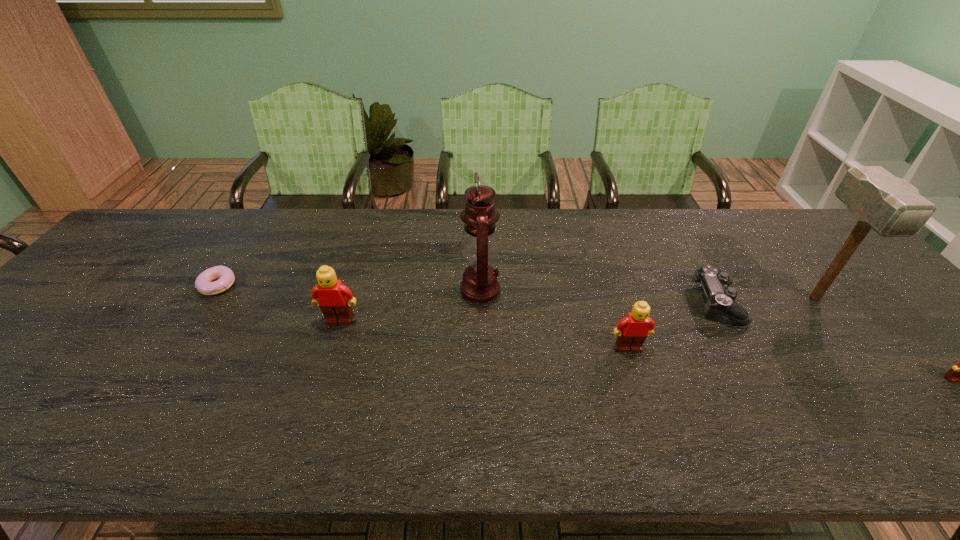
Identify the location of vacant position located 0.190m on the face of the leftmost Lego. The height and width of the screenshot is (540, 960). (317, 392).

Identify the location of vacant space located 0.140m on the face of the second shortest Lego. (647, 407).

You are a GUI agent. You are given a task and a screenshot of the screen. Output one action in this format:
    pyautogui.click(x=<x>, y=<y>)
    Task: Click on the free region located 0.170m on the back of the second shortest object
    This screenshot has width=960, height=540.
    Given the screenshot: What is the action you would take?
    tap(684, 243)

This screenshot has height=540, width=960. What are the coordinates of `vacant space located on the back of the oil lamp` in the screenshot? It's located at (480, 238).

Where is `vacant space situated on the left of the doughnut`? This screenshot has height=540, width=960. vacant space situated on the left of the doughnut is located at coordinates (180, 286).

Locate an element on the screen. The image size is (960, 540). vacant space located on the striking face of the second object from right to left is located at coordinates (850, 341).

Find the location of `object present at the right edge`. object present at the right edge is located at coordinates (889, 205).

Find the location of a particular element. The height and width of the screenshot is (540, 960). free point at the far edge is located at coordinates (690, 214).

The width and height of the screenshot is (960, 540). In the image, there is a desktop. What are the coordinates of `free space at the near edge` in the screenshot? It's located at (853, 401).

The image size is (960, 540). Find the location of `blank space at the left edge`. blank space at the left edge is located at coordinates pyautogui.click(x=26, y=355).